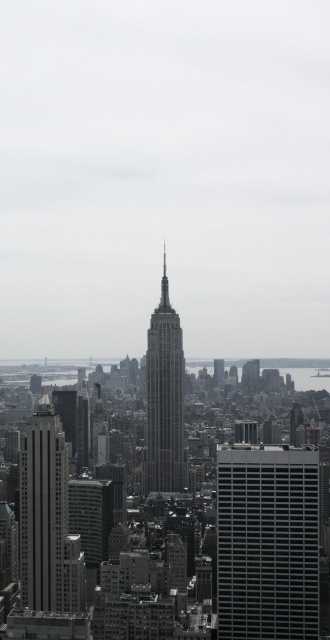
You are a drone operator who needs to fly a drone between the matte black building at center and the gray glass skyscraper at center. The drone has a maximum flight distance of 200 feet. Can the drone safely make the trip between them without exceeding its limit?

The matte black building at center is 197.06 feet away from the gray glass skyscraper at center. Since the drone has a maximum flight distance of 200 feet, it can safely make the trip between them without exceeding its limit.